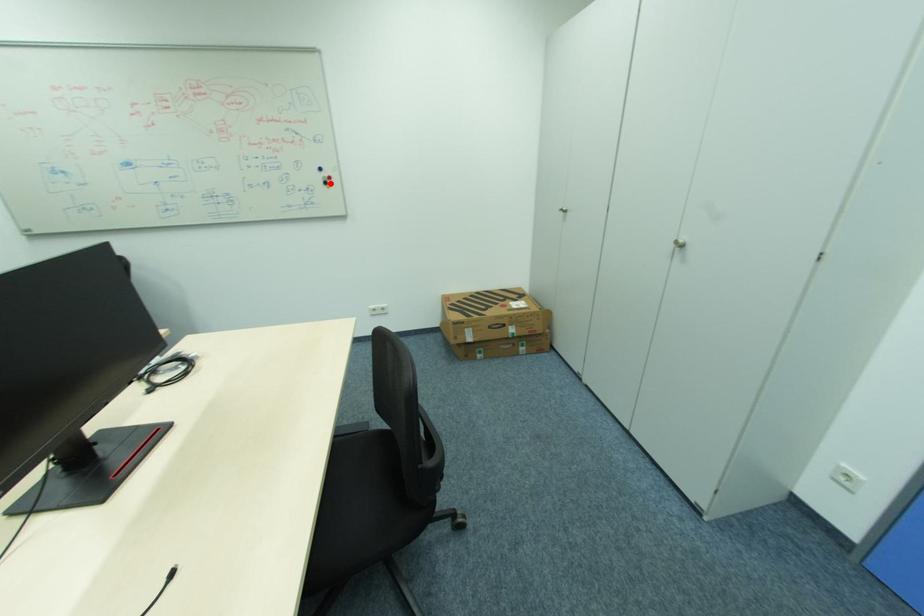
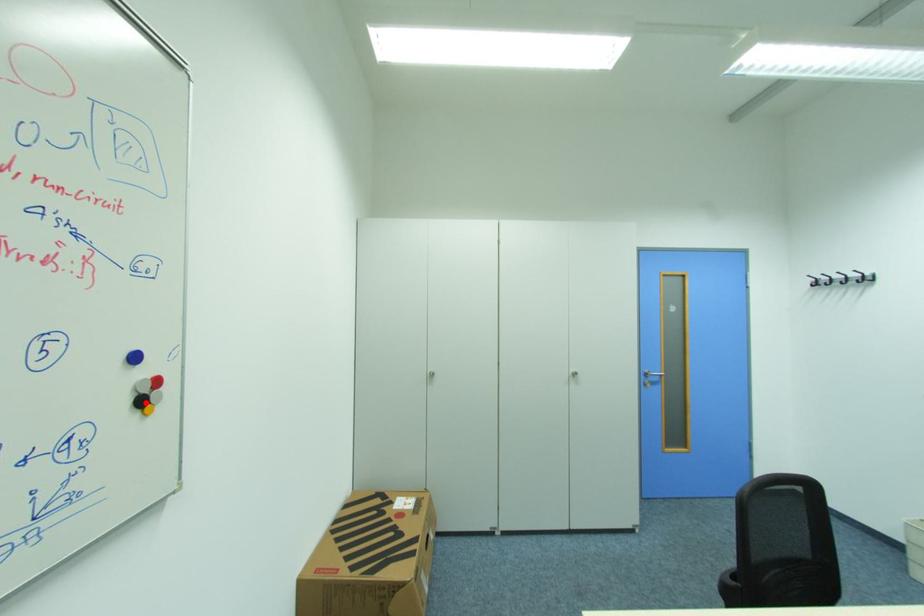
I am providing you with two images of the same scene from different viewpoints. A red point is marked on the first image and another point is marked on the second image. Is the marked point in image1 the same physical position as the marked point in image2?

Yes